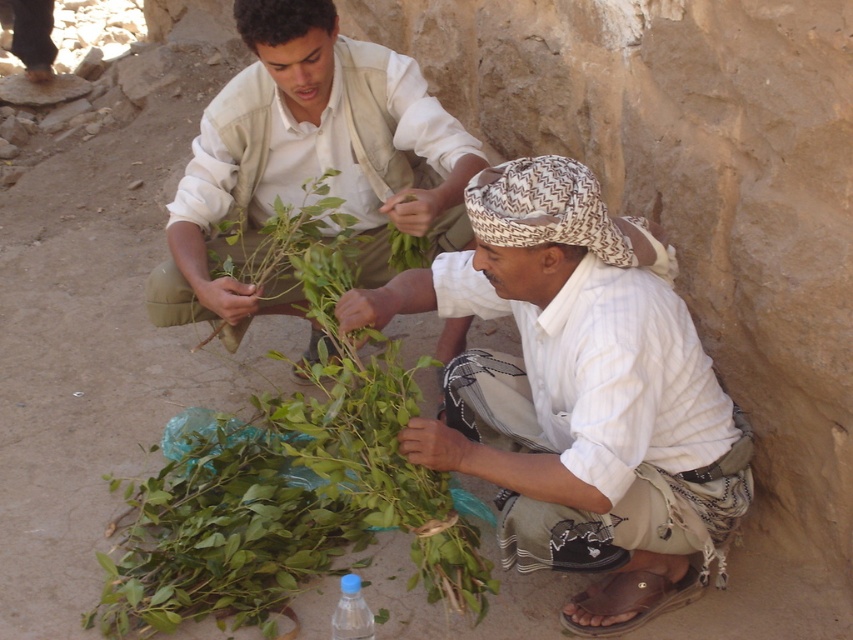
You are a traveler who needs to decide which item is shorter between the white striped fabric at center and the green leafy plant at center. Based on the scene, which one is shorter?

The white striped fabric at center is shorter than the green leafy plant at center, so the white striped fabric at center is the shorter item.